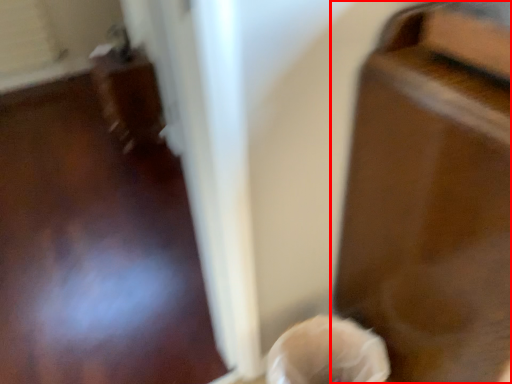
Question: From the image's perspective, where is furniture (annotated by the red box) located relative to woman?

Choices:
 (A) below
 (B) above

Answer: (B)